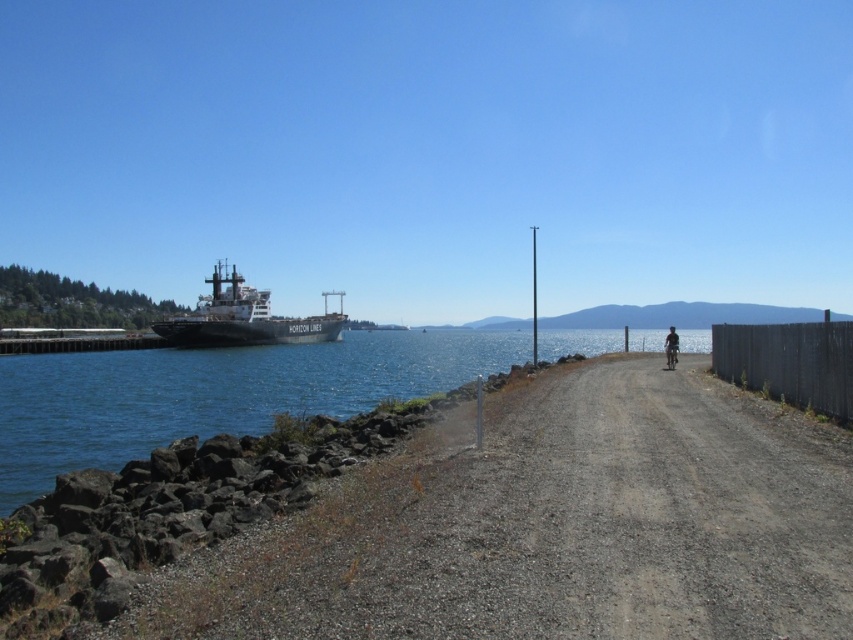
Is white matte cargo ship at left in front of dark blue fabric bicycle at right?

No, white matte cargo ship at left is further to the viewer.

Which is behind, point (219, 344) or point (666, 353)?

The point (219, 344) is behind.

I want to click on white matte cargo ship at left, so click(242, 317).

Is dirt/gravel path at center positioned at the back of dark blue fabric bicycle at right?

No.

Between dirt/gravel path at center and dark blue fabric bicycle at right, which one has less height?

With less height is dirt/gravel path at center.

Who is more forward, [755,400] or [666,346]?

Point [755,400] is in front.

Where is `dirt/gravel path at center`? The image size is (853, 640). dirt/gravel path at center is located at coordinates (550, 529).

Where is `dirt/gravel path at center`? dirt/gravel path at center is located at coordinates (550, 529).

Does dirt/gravel path at center have a smaller size compared to black wooden fence at right?

Correct, dirt/gravel path at center occupies less space than black wooden fence at right.

What do you see at coordinates (550, 529) in the screenshot? This screenshot has width=853, height=640. I see `dirt/gravel path at center` at bounding box center [550, 529].

Find the location of `dirt/gravel path at center`. dirt/gravel path at center is located at coordinates (550, 529).